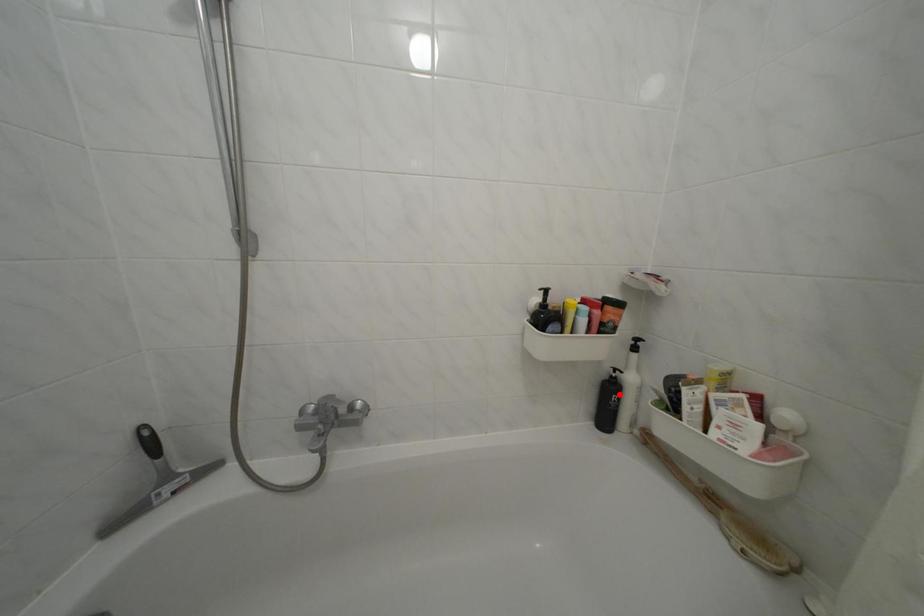
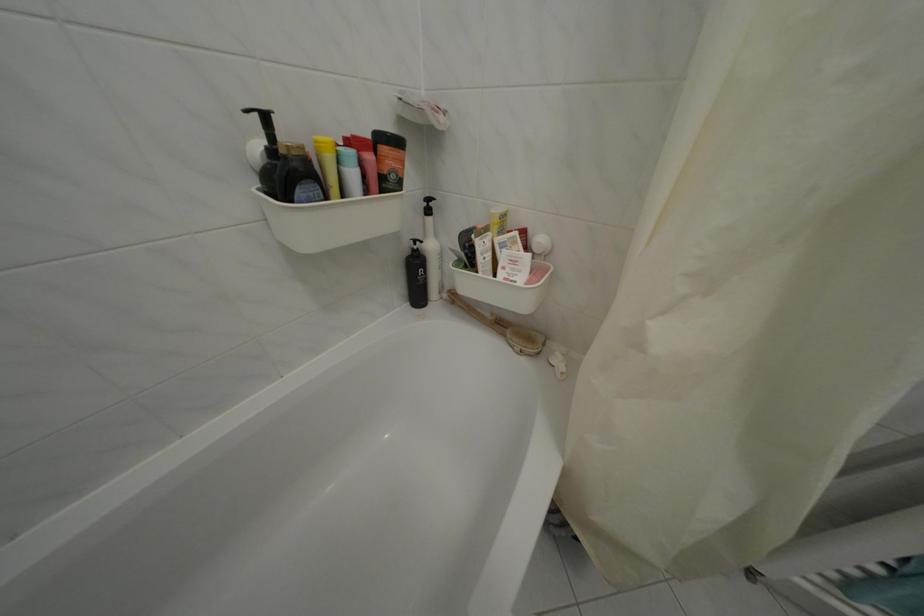
Locate, in the second image, the point that corresponds to the highlighted location in the first image.

(424, 269)